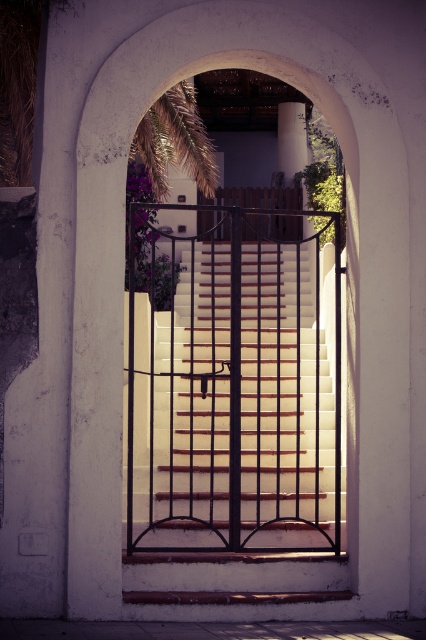
Question: Among these objects, which one is farthest from the camera?

Choices:
 (A) metallic silver balustrade at center
 (B) green leafy palm tree at upper center
 (C) white concrete pillar at upper center

Answer: (C)

Question: Does wooden stairs at center appear under metallic silver balustrade at center?

Choices:
 (A) no
 (B) yes

Answer: (B)

Question: Which point is closer to the camera taking this photo?

Choices:
 (A) (138, 136)
 (B) (324, 404)
 (C) (304, 234)
 (D) (287, 209)

Answer: (B)

Question: Is wooden stairs at center to the right of white concrete pillar at upper center from the viewer's perspective?

Choices:
 (A) no
 (B) yes

Answer: (A)

Question: Is wooden stairs at center to the left of metallic silver balustrade at center from the viewer's perspective?

Choices:
 (A) yes
 (B) no

Answer: (A)

Question: Which point is closer to the camera?

Choices:
 (A) (206, 132)
 (B) (290, 154)
 (C) (198, 317)
 (D) (233, 189)

Answer: (C)